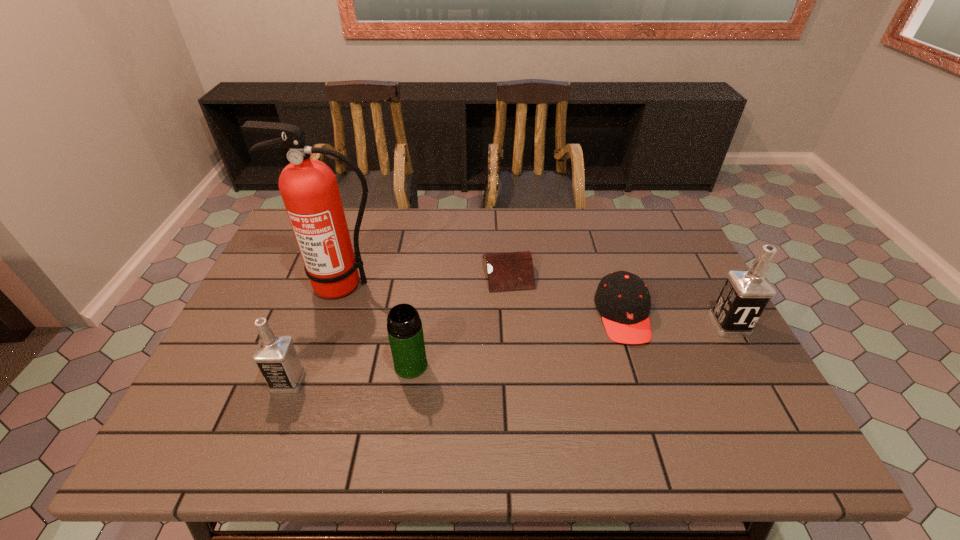
Please point a location where one more vodka can be added evenly. Please provide its 2D coordinates. Your answer should be formatted as a tuple, i.e. [(x, y)], where the tuple contains the x and y coordinates of a point satisfying the conditions above.

[(521, 352)]